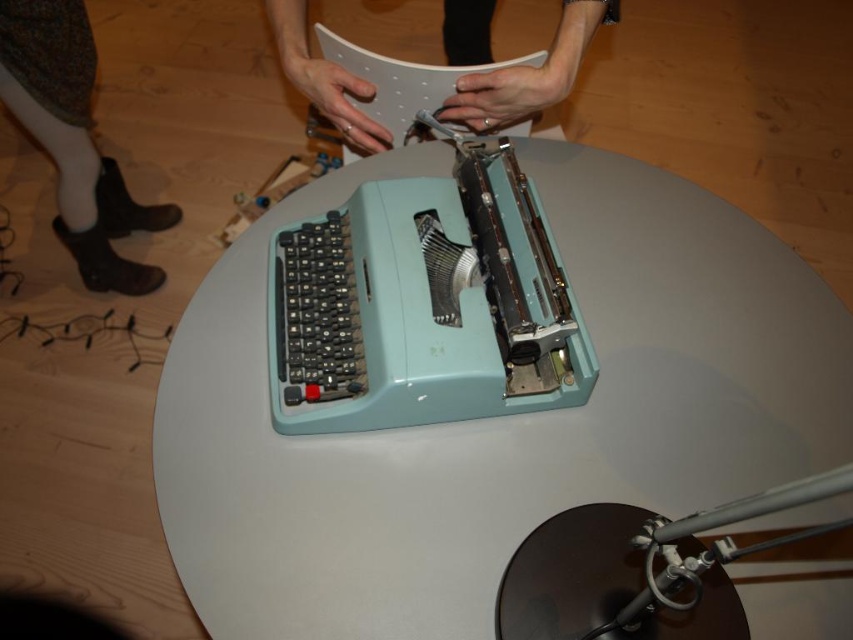
Question: Which object is farther from the camera taking this photo?

Choices:
 (A) light blue plastic typewriter at center
 (B) matte white paper at center
 (C) floral-patterned skirt at lower left

Answer: (C)

Question: Which point is closer to the camera?

Choices:
 (A) (61, 237)
 (B) (190, 520)

Answer: (B)

Question: Can you confirm if light blue plastic typewriter at center is positioned above floral-patterned skirt at lower left?

Choices:
 (A) yes
 (B) no

Answer: (B)

Question: Does light blue plastic typewriter at center have a smaller size compared to floral-patterned skirt at lower left?

Choices:
 (A) yes
 (B) no

Answer: (B)

Question: Where is light blue plastic typewriter at center located in relation to floral-patterned skirt at lower left in the image?

Choices:
 (A) above
 (B) below

Answer: (B)

Question: Which object is farther from the camera taking this photo?

Choices:
 (A) matte white paper at center
 (B) light blue plastic typewriter at center

Answer: (A)